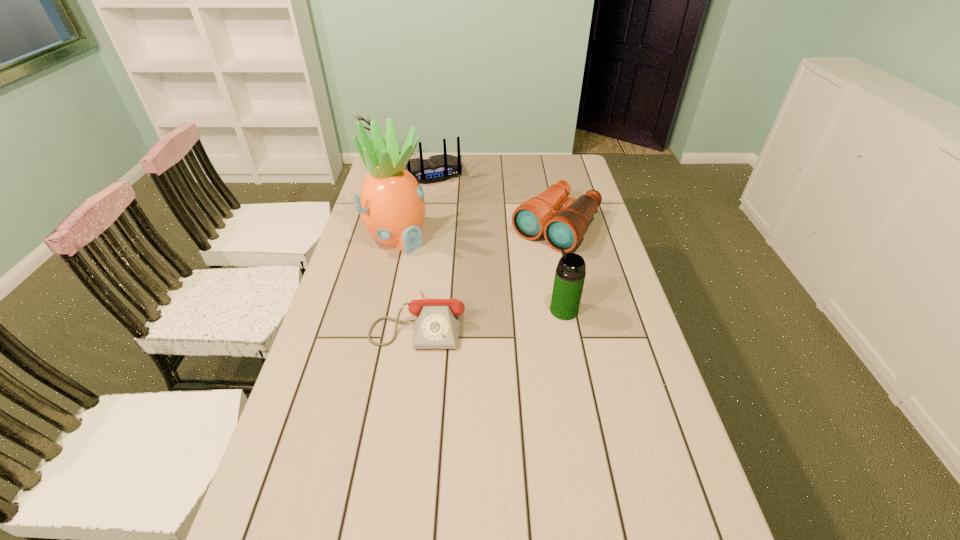
Locate an element on the screen. free space on the desktop that is between the telephone and the fourth shortest object and is positioned at the entrance of the pineapple is located at coordinates (511, 314).

Identify the location of vacant space on the desktop that is between the telephone and the second tallest object and is positioned through the lenses of the binoculars. (474, 316).

The height and width of the screenshot is (540, 960). Identify the location of free spot on the desktop that is between the shortest object and the second tallest object and is positioned on the back of the farthest object. 502,314.